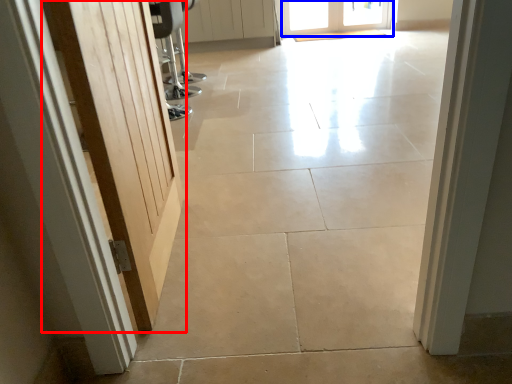
Question: Which object is closer to the camera taking this photo, door (highlighted by a red box) or door (highlighted by a blue box)?

Choices:
 (A) door
 (B) door

Answer: (A)